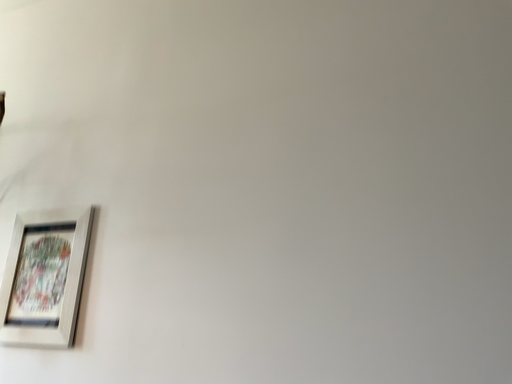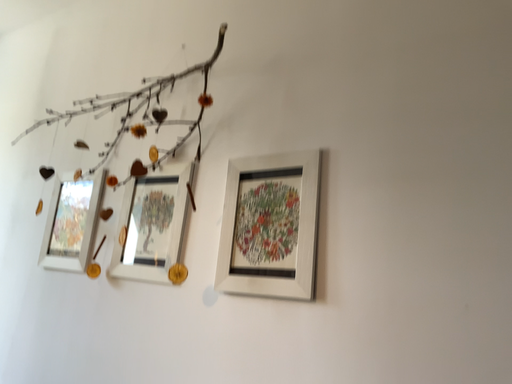
Question: Which way did the camera rotate in the video?

Choices:
 (A) rotated right
 (B) rotated left

Answer: (B)